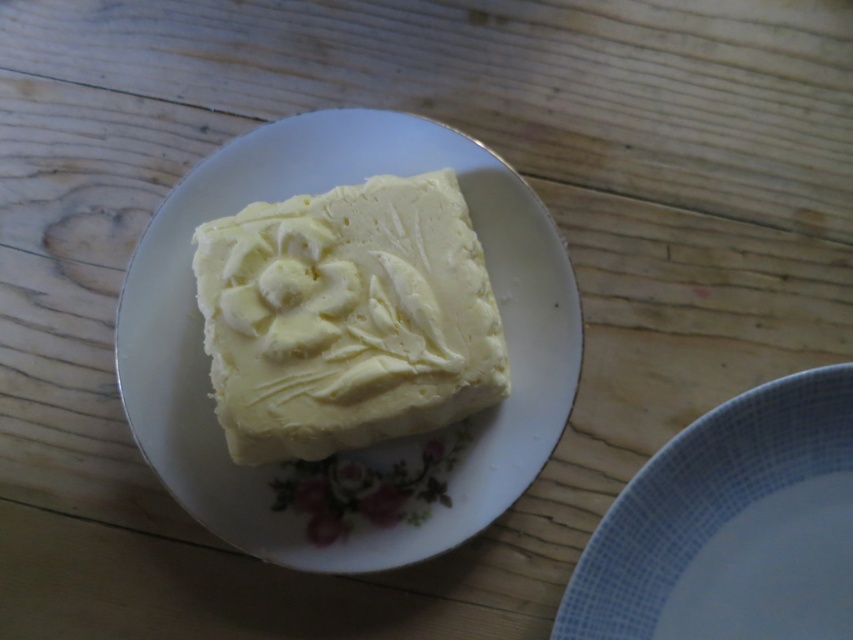
Question: Does white creamy butter at center come in front of white ceramic plate at lower right?

Choices:
 (A) no
 (B) yes

Answer: (A)

Question: Based on their relative distances, which object is farther from the white creamy butter at center?

Choices:
 (A) white ceramic plate at lower right
 (B) white porcelain plate at center

Answer: (A)

Question: Considering the real-world distances, which object is farthest from the white porcelain plate at center?

Choices:
 (A) white creamy butter at center
 (B) white ceramic plate at lower right

Answer: (B)

Question: Which point is farther to the camera?

Choices:
 (A) white ceramic plate at lower right
 (B) white creamy butter at center

Answer: (B)

Question: Can you confirm if white creamy butter at center is bigger than white ceramic plate at lower right?

Choices:
 (A) yes
 (B) no

Answer: (A)

Question: Does white creamy butter at center appear on the left side of white ceramic plate at lower right?

Choices:
 (A) yes
 (B) no

Answer: (A)